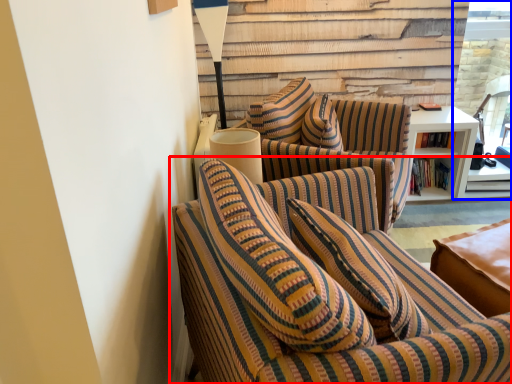
Question: Which of the following is the farthest to the observer, studio couch (highlighted by a red box) or glass door (highlighted by a blue box)?

Choices:
 (A) studio couch
 (B) glass door

Answer: (B)